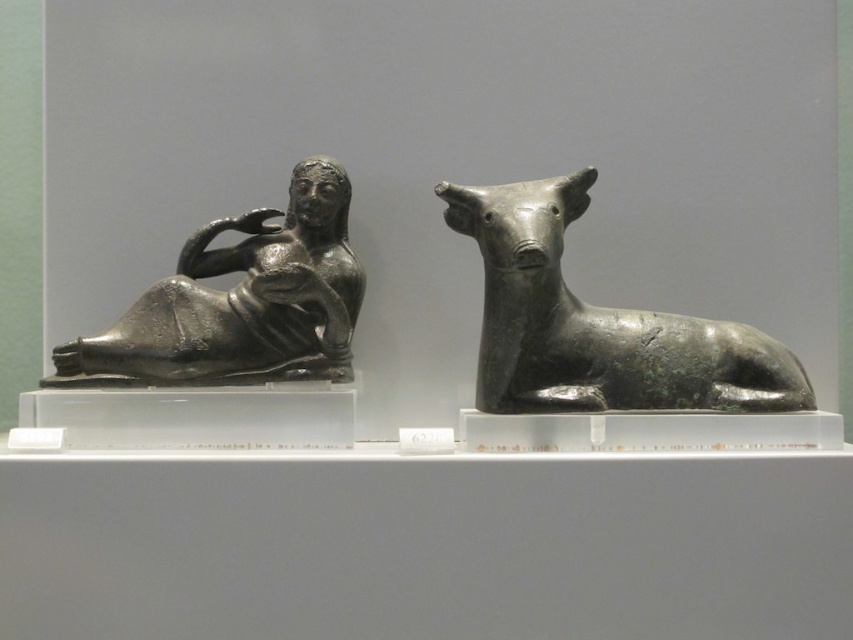
Question: Is bronze bull at right closer to the viewer compared to polished bronze reclining figure at left?

Choices:
 (A) yes
 (B) no

Answer: (A)

Question: Is bronze bull at right above polished bronze reclining figure at left?

Choices:
 (A) yes
 (B) no

Answer: (B)

Question: Among these objects, which one is nearest to the camera?

Choices:
 (A) bronze bull at right
 (B) polished bronze reclining figure at left

Answer: (A)

Question: Observing the image, what is the correct spatial positioning of bronze bull at right in reference to polished bronze reclining figure at left?

Choices:
 (A) above
 (B) below

Answer: (B)

Question: Which object is closer to the camera taking this photo?

Choices:
 (A) bronze bull at right
 (B) polished bronze reclining figure at left

Answer: (A)

Question: Which point is closer to the camera?

Choices:
 (A) (173, 340)
 (B) (775, 346)

Answer: (A)